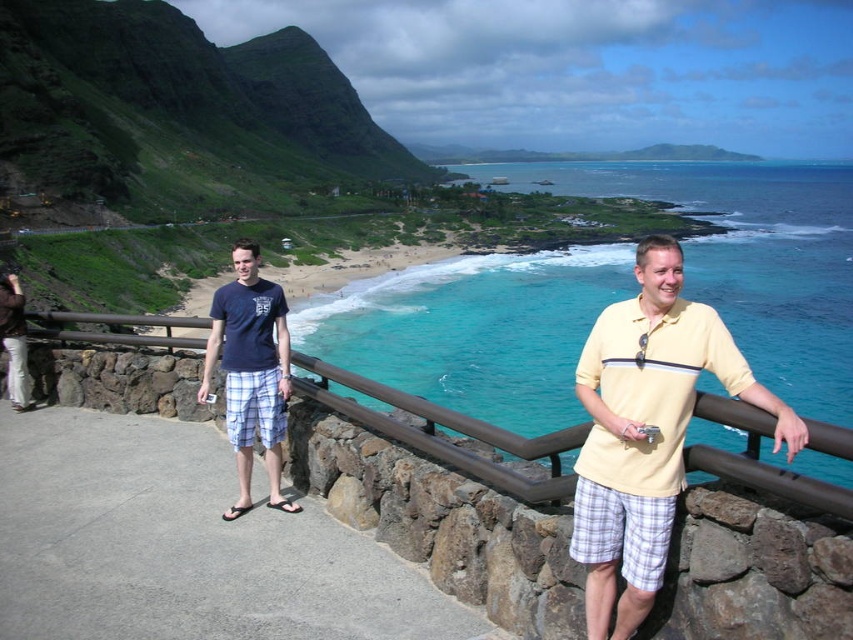
Question: Is yellow cotton shirt at center to the right of brown wood rail at center from the viewer's perspective?

Choices:
 (A) yes
 (B) no

Answer: (A)

Question: Among these points, which one is farthest from the camera?

Choices:
 (A) (566, 332)
 (B) (428, 435)

Answer: (A)

Question: Which object is farther from the camera taking this photo?

Choices:
 (A) matte blue t-shirt at left
 (B) yellow cotton shirt at center
 (C) brown wood rail at center
 (D) turquoise water at upper right

Answer: (A)

Question: Can you confirm if yellow cotton shirt at center is wider than brown wood rail at center?

Choices:
 (A) yes
 (B) no

Answer: (B)

Question: Is turquoise water at upper right to the left of matte blue t-shirt at left from the viewer's perspective?

Choices:
 (A) yes
 (B) no

Answer: (B)

Question: Which object is the farthest from the matte blue t-shirt at left?

Choices:
 (A) turquoise water at upper right
 (B) matte black camera at lower left

Answer: (A)